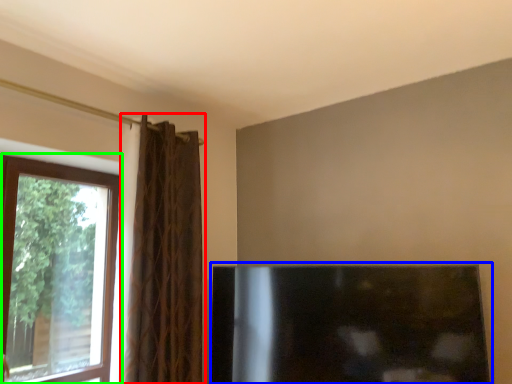
Question: Which object is positioned farthest from curtain (highlighted by a red box)? Select from fireplace (highlighted by a blue box) and window (highlighted by a green box).

Choices:
 (A) fireplace
 (B) window

Answer: (A)